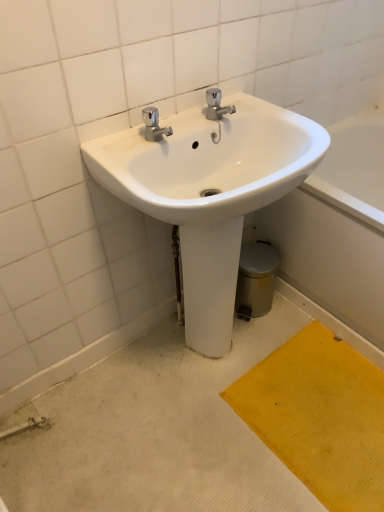
Find the location of `unoccupied region to the right of white glossy sink at center`. unoccupied region to the right of white glossy sink at center is located at coordinates (320, 381).